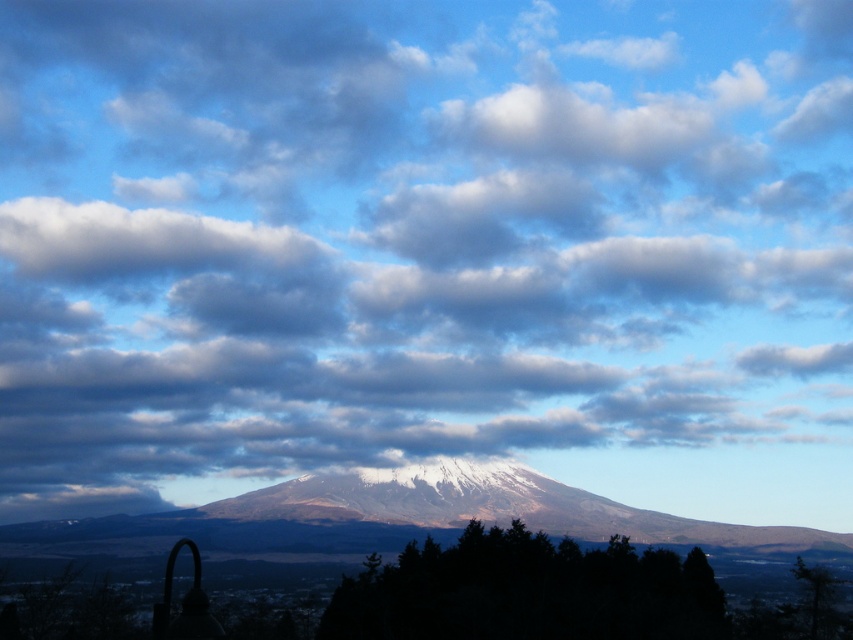
Which is in front, point (262, 524) or point (461, 628)?

Point (461, 628) is more forward.

What do you see at coordinates (416, 513) in the screenshot? I see `white snow-covered mountain at center` at bounding box center [416, 513].

The height and width of the screenshot is (640, 853). In order to click on white snow-covered mountain at center in this screenshot , I will do `click(416, 513)`.